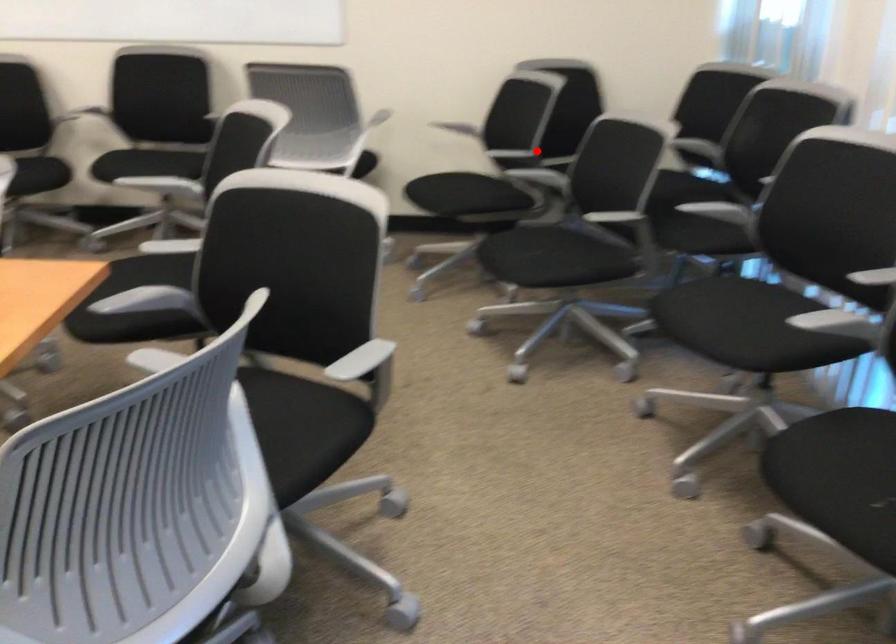
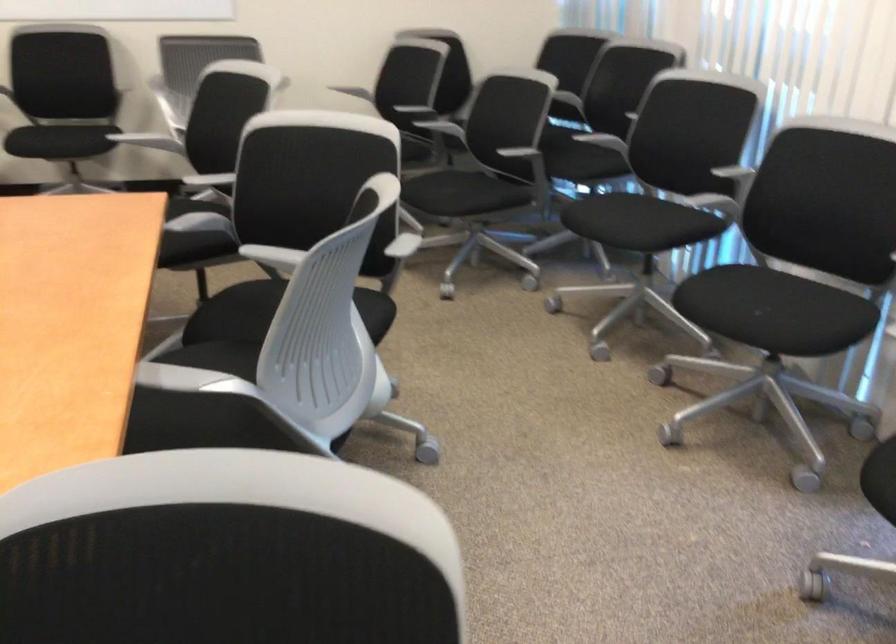
Find the pixel in the second image that matches the highlighted location in the first image.

(432, 107)